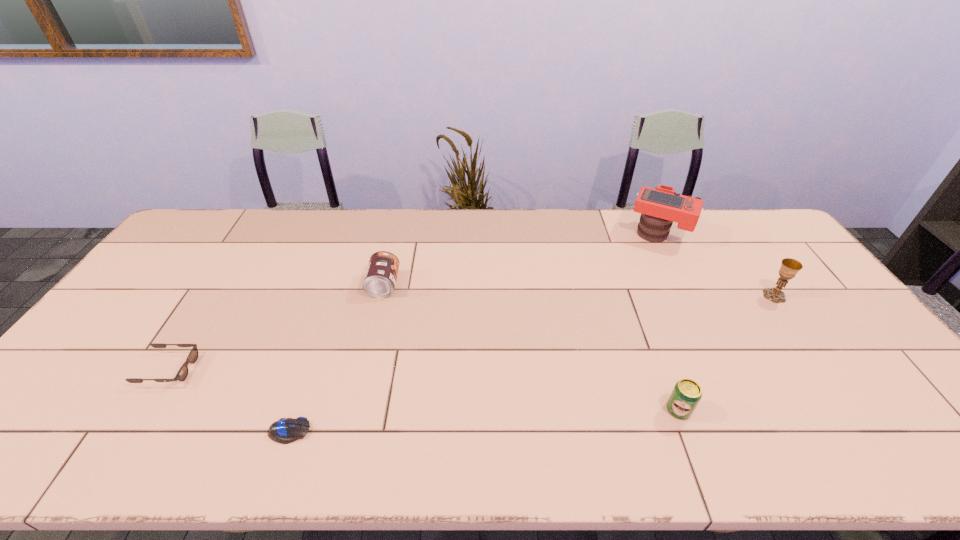
Locate an element on the screen. The width and height of the screenshot is (960, 540). vacant position in the image that satisfies the following two spatial constraints: 1. on the front label of the beer can; 2. on the left side of the can is located at coordinates (354, 409).